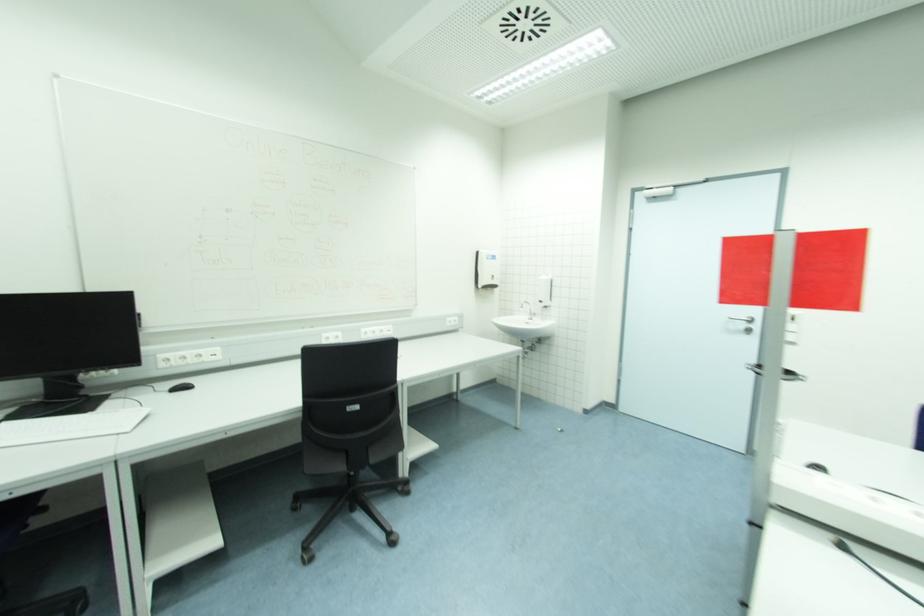
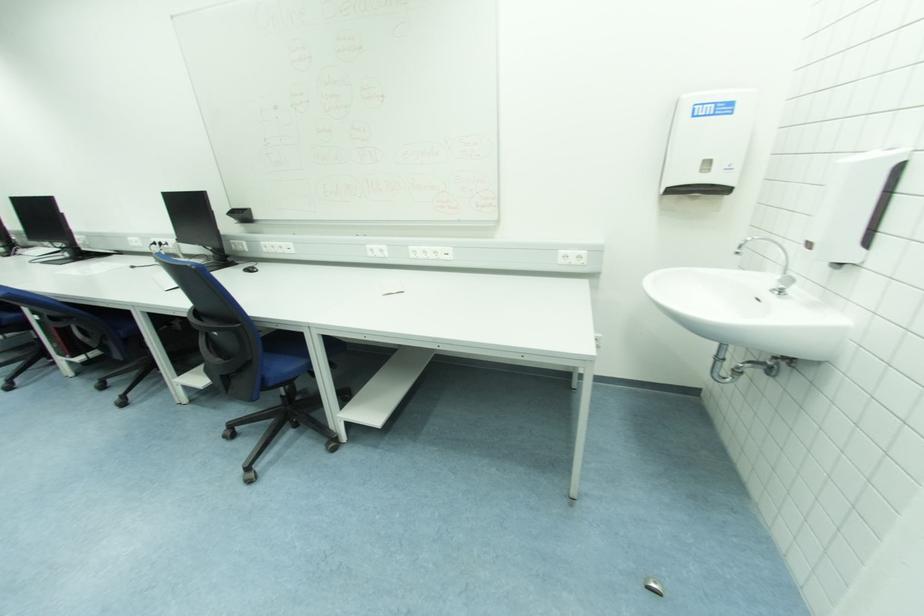
Find the pixel in the second image that matches the point at 496,259 in the first image.

(731, 110)